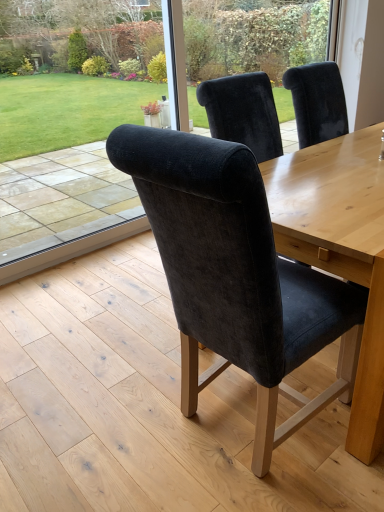
Question: From the image's perspective, is velvet chair back at center above transparent glass door at upper center?

Choices:
 (A) no
 (B) yes

Answer: (A)

Question: Considering the relative positions of velvet chair back at center and transparent glass door at upper center in the image provided, is velvet chair back at center in front of transparent glass door at upper center?

Choices:
 (A) yes
 (B) no

Answer: (A)

Question: Is velvet chair back at center oriented towards transparent glass door at upper center?

Choices:
 (A) no
 (B) yes

Answer: (A)

Question: Is velvet chair back at center smaller than transparent glass door at upper center?

Choices:
 (A) no
 (B) yes

Answer: (A)

Question: Does velvet chair back at center have a greater width compared to transparent glass door at upper center?

Choices:
 (A) no
 (B) yes

Answer: (B)

Question: From a real-world perspective, is velvet chair back at center over transparent glass door at upper center?

Choices:
 (A) no
 (B) yes

Answer: (A)

Question: Considering the relative sizes of transparent glass door at upper center and velvet chair back at center in the image provided, is transparent glass door at upper center taller than velvet chair back at center?

Choices:
 (A) no
 (B) yes

Answer: (A)

Question: From a real-world perspective, does transparent glass door at upper center sit lower than velvet chair back at center?

Choices:
 (A) no
 (B) yes

Answer: (A)

Question: From the image's perspective, is transparent glass door at upper center on velvet chair back at center?

Choices:
 (A) no
 (B) yes

Answer: (B)

Question: Can you confirm if transparent glass door at upper center is wider than velvet chair back at center?

Choices:
 (A) yes
 (B) no

Answer: (B)

Question: Is velvet chair back at center at the back of transparent glass door at upper center?

Choices:
 (A) no
 (B) yes

Answer: (A)

Question: Is transparent glass door at upper center thinner than velvet chair back at center?

Choices:
 (A) yes
 (B) no

Answer: (A)

Question: Is the depth of velvet chair back at center greater than that of velvet dark blue chair at center?

Choices:
 (A) yes
 (B) no

Answer: (A)